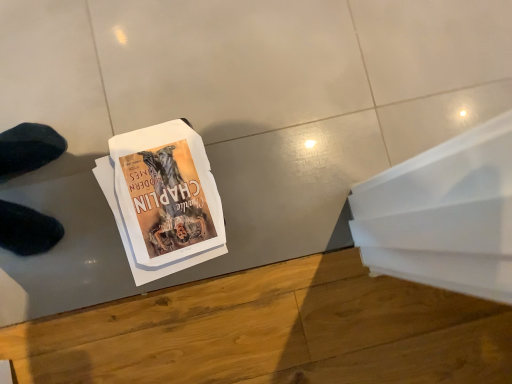
Describe the element at coordinates (163, 199) in the screenshot. Image resolution: width=512 pixels, height=384 pixels. I see `matte paper book at center` at that location.

In order to click on matte paper book at center in this screenshot , I will do `click(163, 199)`.

Where is `matte paper book at center`? Image resolution: width=512 pixels, height=384 pixels. matte paper book at center is located at coordinates (163, 199).